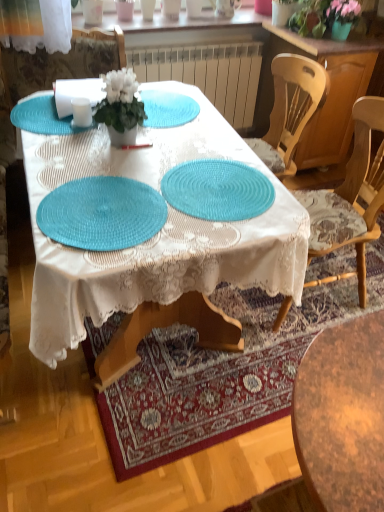
Measure the distance between green leafy plant at upper right and camera.

green leafy plant at upper right is 7.68 feet from camera.

Image resolution: width=384 pixels, height=512 pixels. In order to click on teal woven placemat at center, positioned as the 3th glass plate in top-to-bottom order in this screenshot , I will do `click(102, 213)`.

What do you see at coordinates (44, 117) in the screenshot?
I see `teal woven placemat at upper left, which ranks as the third glass plate in bottom-to-top order` at bounding box center [44, 117].

What do you see at coordinates (329, 91) in the screenshot? I see `wooden cabinet at right` at bounding box center [329, 91].

In order to face matte white chair at upper left, the second chair in the right-to-left sequence, should I rotate leftwards or rightwards?

Turn left approximately 15.815 degrees to face it.

The height and width of the screenshot is (512, 384). Describe the element at coordinates (148, 9) in the screenshot. I see `white glossy cup at upper center` at that location.

The image size is (384, 512). What are the coordinates of `green leafy plant at upper right` in the screenshot? It's located at (323, 16).

Which is more to the right, teal woven placemat at center, the 1th glass plate ordered from the bottom, or white matte pot at center?

white matte pot at center is more to the right.

From the image's perspective, which is below, teal woven placemat at center, positioned as the 3th glass plate in top-to-bottom order, or white matte pot at center?

From the image's view, teal woven placemat at center, positioned as the 3th glass plate in top-to-bottom order, is below.

From a real-world perspective, which object rests below the other?

From a 3D spatial view, teal woven placemat at center, positioned as the 3th glass plate in top-to-bottom order, is below.

Is teal woven placemat at center, the 1th glass plate ordered from the bottom, far away from white matte pot at center?

No.

From a real-world perspective, is green leafy plant at upper right above or below white matte pot at center?

green leafy plant at upper right is above white matte pot at center.

In terms of size, does green leafy plant at upper right appear bigger or smaller than white matte pot at center?

In the image, green leafy plant at upper right appears to be larger than white matte pot at center.

From their relative heights in the image, would you say green leafy plant at upper right is taller or shorter than white matte pot at center?

Clearly, green leafy plant at upper right is shorter compared to white matte pot at center.

Considering the positions of point (310, 1) and point (112, 96), is point (310, 1) closer or farther from the camera than point (112, 96)?

Point (310, 1) is positioned farther from the camera compared to point (112, 96).

Which is in front, point (327, 218) or point (236, 206)?

The point (236, 206) is more forward.

How distant is wooden chair at right, the second chair positioned from the left, from teal woven placemat at center, the second glass plate positioned from the bottom?

wooden chair at right, the second chair positioned from the left, and teal woven placemat at center, the second glass plate positioned from the bottom, are 20.64 inches apart.

Is wooden chair at right, which is the first chair from right to left, to the right of teal woven placemat at center, which ranks as the second glass plate in top-to-bottom order, from the viewer's perspective?

Correct, you'll find wooden chair at right, which is the first chair from right to left, to the right of teal woven placemat at center, which ranks as the second glass plate in top-to-bottom order.

From the picture: Is wooden chair at right, which is the first chair from right to left, with teal woven placemat at center, the second glass plate positioned from the bottom?

They are not placed beside each other.

From a real-world perspective, is green leafy plant at upper right physically above white glossy cup at upper center?

No, from a real-world perspective, green leafy plant at upper right is not above white glossy cup at upper center.

Considering their positions, is green leafy plant at upper right located in front of or behind white glossy cup at upper center?

green leafy plant at upper right is positioned closer to the viewer than white glossy cup at upper center.

Is green leafy plant at upper right facing towards white glossy cup at upper center?

No, green leafy plant at upper right does not turn towards white glossy cup at upper center.

There is a green leafy plant at upper right. Where is `tableware above it (from a real-world perspective)`? This screenshot has height=512, width=384. tableware above it (from a real-world perspective) is located at coordinates (148, 9).

Measure the distance between teal woven placemat at center and teal woven placemat at center, the second glass plate positioned from the bottom.

teal woven placemat at center and teal woven placemat at center, the second glass plate positioned from the bottom, are 7.59 inches apart from each other.

Does teal woven placemat at center have a greater height compared to teal woven placemat at center, which ranks as the second glass plate in top-to-bottom order?

Correct, teal woven placemat at center is much taller as teal woven placemat at center, which ranks as the second glass plate in top-to-bottom order.

Can you confirm if teal woven placemat at center is wider than teal woven placemat at center, the second glass plate positioned from the bottom?

Indeed, teal woven placemat at center has a greater width compared to teal woven placemat at center, the second glass plate positioned from the bottom.

Considering the relative positions of teal woven placemat at center and teal woven placemat at center, the second glass plate positioned from the bottom, in the image provided, is teal woven placemat at center to the right of teal woven placemat at center, the second glass plate positioned from the bottom, from the viewer's perspective?

No.

Which of these two, green leafy plant at upper right or wooden chair at right, the second chair positioned from the left, stands shorter?

Standing shorter between the two is green leafy plant at upper right.

Does green leafy plant at upper right have a lesser width compared to wooden chair at right, which is the first chair from right to left?

Yes, green leafy plant at upper right is thinner than wooden chair at right, which is the first chair from right to left.

From the picture: Between green leafy plant at upper right and wooden chair at right, which is the first chair from right to left, which one has larger size?

wooden chair at right, which is the first chair from right to left.

Locate an element on the screen. the 1st chair counting from the left of the green leafy plant at upper right is located at coordinates (349, 200).

Is matte white chair at upper left, the second chair in the right-to-left sequence, at the right side of teal woven placemat at upper left, acting as the first glass plate starting from the top?

In fact, matte white chair at upper left, the second chair in the right-to-left sequence, is to the left of teal woven placemat at upper left, acting as the first glass plate starting from the top.

Could you tell me if matte white chair at upper left, placed as the 1th chair when sorted from left to right, is turned towards teal woven placemat at upper left, which ranks as the third glass plate in bottom-to-top order?

Yes, matte white chair at upper left, placed as the 1th chair when sorted from left to right, is facing teal woven placemat at upper left, which ranks as the third glass plate in bottom-to-top order.

Does matte white chair at upper left, the second chair in the right-to-left sequence, have a greater height compared to teal woven placemat at upper left, which ranks as the third glass plate in bottom-to-top order?

Correct, matte white chair at upper left, the second chair in the right-to-left sequence, is much taller as teal woven placemat at upper left, which ranks as the third glass plate in bottom-to-top order.

From the image's perspective, between matte white chair at upper left, the second chair in the right-to-left sequence, and teal woven placemat at upper left, acting as the first glass plate starting from the top, which one is located above?

matte white chair at upper left, the second chair in the right-to-left sequence, is shown above in the image.

Locate an element on the screen. The width and height of the screenshot is (384, 512). the 2nd glass plate in front when counting from the white matte pot at center is located at coordinates (102, 213).

At what (x,y) coordinates should I click in order to perform the action: click on floral arrangement behind the white matte pot at center. Please return your answer as a coordinate pair (x, y). The height and width of the screenshot is (512, 384). Looking at the image, I should click on (323, 16).

Looking at the image, which one is located further to green leafy plant at upper right, wooden chair at right, the second chair positioned from the left, or wooden cabinet at right?

wooden chair at right, the second chair positioned from the left.

Considering their positions, is white glossy cup at upper center positioned closer to white matte pot at center than teal woven placemat at center, the second glass plate positioned from the bottom?

teal woven placemat at center, the second glass plate positioned from the bottom.

When comparing their distances from green leafy plant at upper right, does matte white chair at upper left, the second chair in the right-to-left sequence, or white glossy cup at upper center seem further?

matte white chair at upper left, the second chair in the right-to-left sequence, is positioned further to the anchor green leafy plant at upper right.

Based on their spatial positions, is teal woven placemat at center, the 1th glass plate ordered from the bottom, or wooden cabinet at right further from teal woven placemat at center?

wooden cabinet at right lies further to teal woven placemat at center than the other object.

Based on their spatial positions, is wooden cabinet at right or teal woven placemat at upper left, which ranks as the third glass plate in bottom-to-top order, further from wooden chair at right, the second chair positioned from the left?

teal woven placemat at upper left, which ranks as the third glass plate in bottom-to-top order, is further to wooden chair at right, the second chair positioned from the left.

When comparing their distances from white glossy cup at upper center, does teal woven placemat at center or teal woven placemat at center, positioned as the 3th glass plate in top-to-bottom order, seem further?

Among the two, teal woven placemat at center, positioned as the 3th glass plate in top-to-bottom order, is located further to white glossy cup at upper center.

Looking at the image, which one is located further to white glossy cup at upper center, matte white chair at upper left, placed as the 1th chair when sorted from left to right, or teal woven placemat at center, which ranks as the second glass plate in top-to-bottom order?

The object further to white glossy cup at upper center is teal woven placemat at center, which ranks as the second glass plate in top-to-bottom order.

Looking at the image, which one is located closer to teal woven placemat at center, the second glass plate positioned from the bottom, wooden cabinet at right or wooden chair at right, which is the first chair from right to left?

Among the two, wooden chair at right, which is the first chair from right to left, is located nearer to teal woven placemat at center, the second glass plate positioned from the bottom.

You are a GUI agent. You are given a task and a screenshot of the screen. Output one action in this format:
    pyautogui.click(x=<x>, y=<y>)
    Task: Click on the houseplant between teal woven placemat at upper left, which ranks as the third glass plate in bottom-to-top order, and green leafy plant at upper right from left to right
    The height and width of the screenshot is (512, 384).
    Given the screenshot: What is the action you would take?
    pyautogui.click(x=120, y=106)

The width and height of the screenshot is (384, 512). I want to click on desk between matte white chair at upper left, the second chair in the right-to-left sequence, and wooden cabinet at right from left to right, so click(157, 234).

Locate an element on the screen. houseplant between white glossy cup at upper center and wooden chair at right, the second chair positioned from the left, in the vertical direction is located at coordinates (120, 106).

At what (x,y) coordinates should I click in order to perform the action: click on cabinetry between teal woven placemat at center and white glossy cup at upper center in the front-back direction. Please return your answer as a coordinate pair (x, y). Looking at the image, I should click on (329, 91).